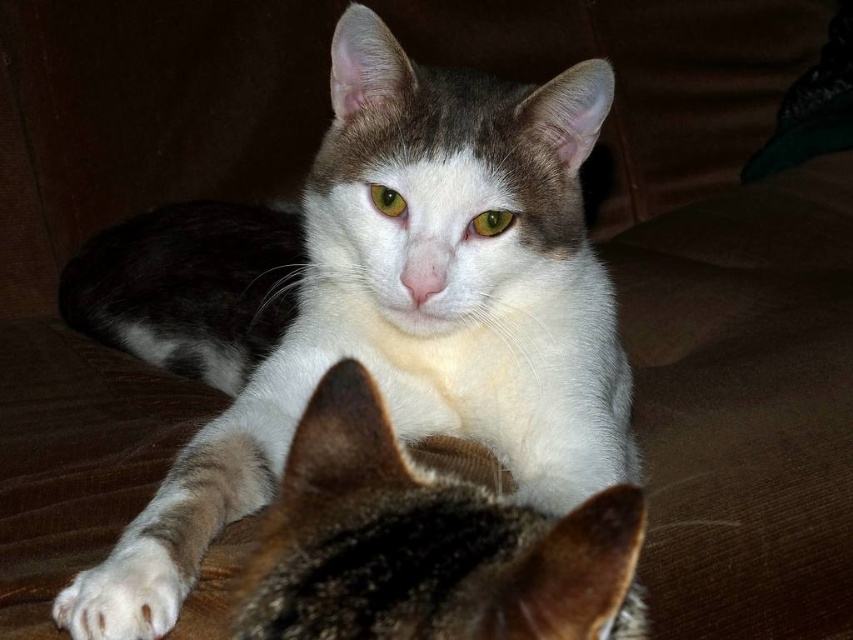
From the picture: You are a cat owner who wants to check if your cats are comfortable. You see the white fur at center and the white fluffy paw at lower left. Which one is positioned higher in the image?

The white fur at center is located above the white fluffy paw at lower left, so it is positioned higher in the image.

You are a photographer trying to capture both the white fur at center and the white fluffy paw at lower left in a single frame. Based on their positions, which one would appear closer to the camera?

The white fur at center appears closer to the camera because it is taller than the white fluffy paw at lower left, indicating it is positioned in front.

You are a cat owner who wants to place a small toy between the white fur cat at center and the white fluffy paw at lower left. What is the minimum distance the toy should be placed from each cat to ensure it is exactly in the middle?

The minimum distance the toy should be placed from each cat is 10.47 inches, which is half of the 20.94 inches separating the white fur cat at center and the white fluffy paw at lower left.